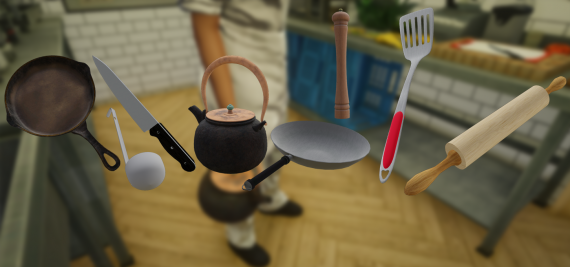
Where is `wooden handle`? wooden handle is located at coordinates (237, 60).